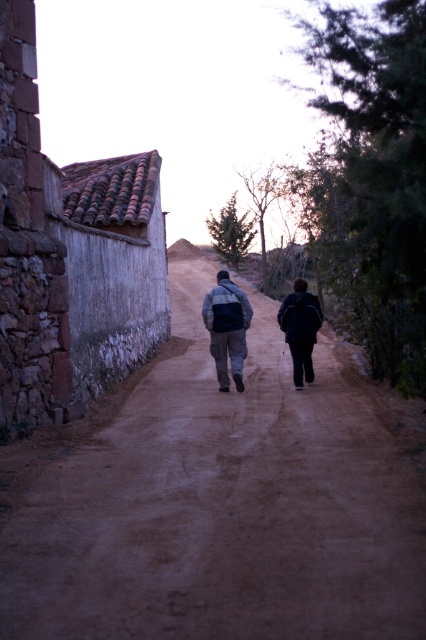
You are standing at the camera position and want to reach the point marked at coordinates (158, 417). The path is 30 feet long from where you are standing. Can you walk directly to the point without needing to go around any obstacles?

The point marked at coordinates (158, 417) is 29.48 feet away from the camera, which is within the 30 feet length of the path. Therefore, you can walk directly to the point without needing to go around any obstacles.

You are standing at the starting point of the dirt path in the rural scene. You notice two points marked on the image. One is at coordinate point(379, 563) and the other at point(218, 330). Which point is closer to your current position?

Point(379, 563) is closer to the camera than point(218, 330), so the point at coordinate point(379, 563) is closer to your current position.

You are a hiker carrying a dark blue backpack at center and wearing a matte gray jacket at center. You want to check if there is enough space between your backpack and jacket to fit a 1.50 inch thick map. Can you fit the map between them?

The dark blue backpack at center is 1.40 inches away from the matte gray jacket at center. Since the distance is less than the map thickness of 1.50 inches, the map cannot fit between them.